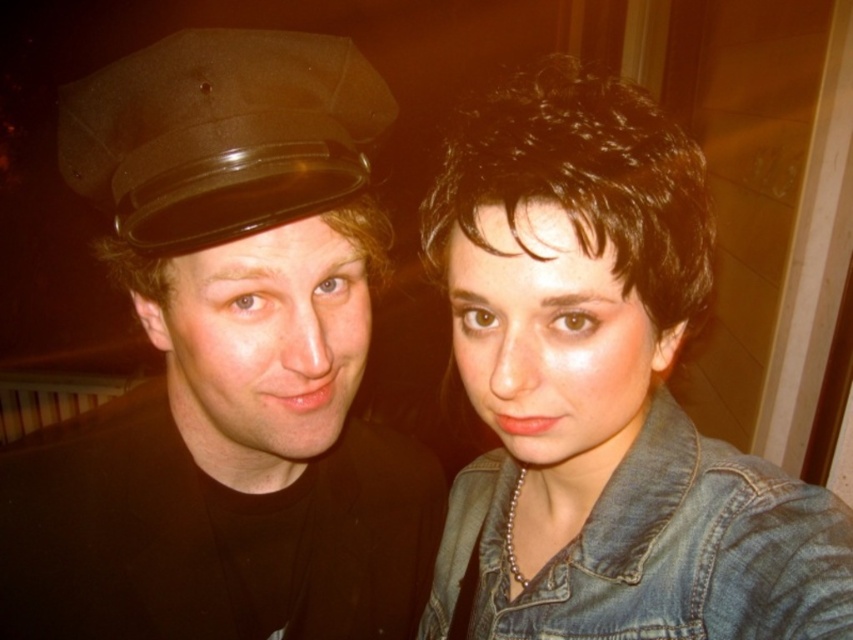
Question: Considering the relative positions of matte black hat at left and denim jacket at upper right in the image provided, where is matte black hat at left located with respect to denim jacket at upper right?

Choices:
 (A) below
 (B) above

Answer: (A)

Question: Which is nearer to the faded denim jacket at lower right?

Choices:
 (A) denim jacket at upper right
 (B) matte black hat at left

Answer: (A)

Question: Considering the real-world distances, which object is closest to the matte black hat at left?

Choices:
 (A) denim jacket at upper right
 (B) faded denim jacket at lower right
 (C) shiny brown hat at upper left

Answer: (C)

Question: Which object appears closest to the camera in this image?

Choices:
 (A) matte black hat at left
 (B) denim jacket at upper right
 (C) shiny brown hat at upper left

Answer: (A)

Question: Does matte black hat at left appear under shiny brown hat at upper left?

Choices:
 (A) no
 (B) yes

Answer: (B)

Question: From the image, what is the correct spatial relationship of faded denim jacket at lower right in relation to shiny brown hat at upper left?

Choices:
 (A) right
 (B) left

Answer: (A)